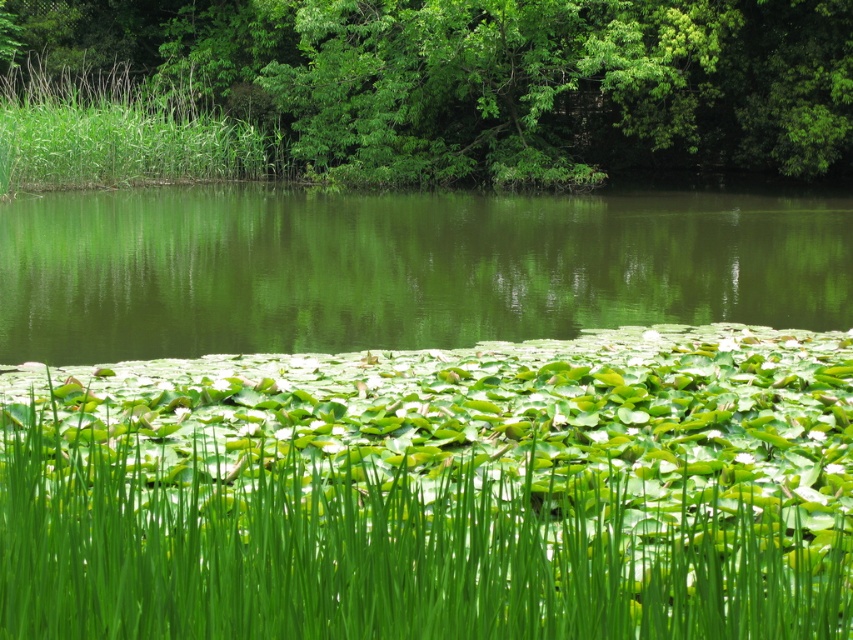
Between green grass at bottom and green leafy tree at upper center, which one has more height?

green leafy tree at upper center is taller.

Does point (405, 509) come closer to viewer compared to point (836, 99)?

Yes.

The width and height of the screenshot is (853, 640). Identify the location of green grass at bottom. (437, 492).

Can you confirm if green smooth water at center is wider than green leafy tree at upper center?

In fact, green smooth water at center might be narrower than green leafy tree at upper center.

Is green smooth water at center to the left of green leafy tree at upper center from the viewer's perspective?

In fact, green smooth water at center is to the right of green leafy tree at upper center.

Where is `green smooth water at center`? green smooth water at center is located at coordinates (401, 268).

I want to click on green smooth water at center, so click(x=401, y=268).

Is green grass at bottom above green smooth water at center?

No, green grass at bottom is not above green smooth water at center.

What do you see at coordinates (437, 492) in the screenshot?
I see `green grass at bottom` at bounding box center [437, 492].

Where is `green grass at bottom`? green grass at bottom is located at coordinates (437, 492).